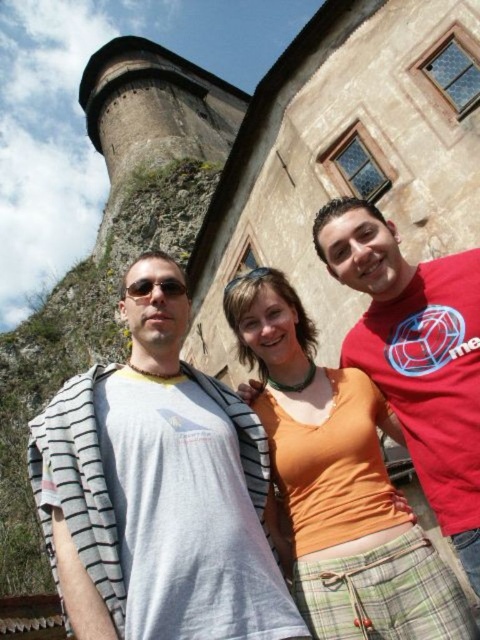
Question: Is gray striped shirt at left smaller than orange fabric top at center?

Choices:
 (A) yes
 (B) no

Answer: (B)

Question: Which object appears closest to the camera in this image?

Choices:
 (A) orange fabric top at center
 (B) gray striped shirt at left

Answer: (B)

Question: Does gray striped shirt at left have a smaller size compared to orange fabric top at center?

Choices:
 (A) no
 (B) yes

Answer: (A)

Question: Is gray striped shirt at left bigger than orange fabric top at center?

Choices:
 (A) yes
 (B) no

Answer: (A)